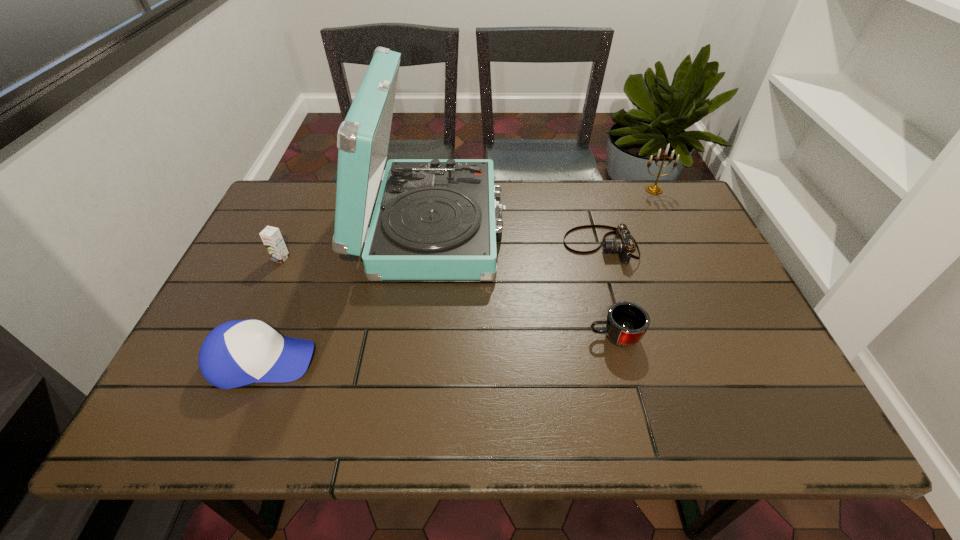
You are a GUI agent. You are given a task and a screenshot of the screen. Output one action in this format:
    pyautogui.click(x=<x>, y=<y>)
    Task: Click on the camera located in the far edge section of the desktop
    Image resolution: width=960 pixels, height=540 pixels.
    Given the screenshot: What is the action you would take?
    pyautogui.click(x=623, y=243)

Locate an element on the screen. This screenshot has height=540, width=960. chocolate milk at the left edge is located at coordinates (271, 236).

Identify the location of baseball cap positioned at the left edge. (236, 353).

Locate an element on the screen. This screenshot has height=540, width=960. object situated at the right edge is located at coordinates (652, 189).

This screenshot has height=540, width=960. In order to click on object located at the far right corner in this screenshot , I will do `click(652, 189)`.

The height and width of the screenshot is (540, 960). Find the location of `vacant space at the far edge of the desktop`. vacant space at the far edge of the desktop is located at coordinates (507, 197).

Locate an element on the screen. This screenshot has width=960, height=540. blank space at the near edge of the desktop is located at coordinates (660, 410).

The height and width of the screenshot is (540, 960). I want to click on vacant space at the left edge of the desktop, so click(x=275, y=285).

You are a GUI agent. You are given a task and a screenshot of the screen. Output one action in this format:
    pyautogui.click(x=<x>, y=<y>)
    Task: Click on the vacant space at the right edge of the desktop
    This screenshot has height=540, width=960.
    Given the screenshot: What is the action you would take?
    pyautogui.click(x=739, y=382)

Image resolution: width=960 pixels, height=540 pixels. What are the coordinates of `free space at the near left corner of the desktop` in the screenshot? It's located at (176, 413).